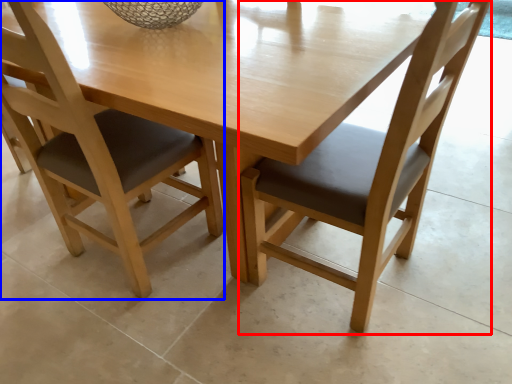
Question: Which of the following is the farthest to the observer, chair (highlighted by a red box) or chair (highlighted by a blue box)?

Choices:
 (A) chair
 (B) chair

Answer: (B)